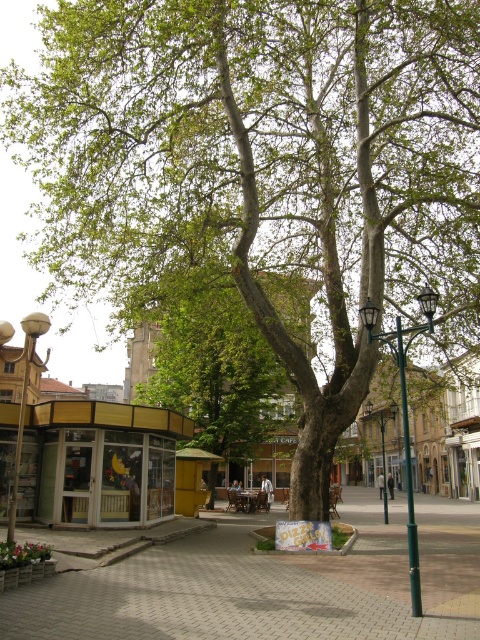
You are a tourist in the plaza and want to buy a souvenir. You see the yellow glass kiosk at center and the matte white lamp post at left. Which object is closer to the path leading to the main square? Please answer based on their positions relative to each other.

The yellow glass kiosk at center is positioned on the right side of matte white lamp post at left, so the matte white lamp post at left is closer to the path leading to the main square since it is positioned to the left of the kiosk.

You are standing in the plaza and want to take a photo of the point at coordinates (296, 288). Based on the distance provided, will this point be in focus if your camera is set to auto focus with a depth of field that can sharply capture objects up to 100 feet away?

The point at coordinates (296, 288) is 100.24 feet from the camera, which is slightly beyond the 100 feet depth of field limit. Therefore, the point may not be in focus.